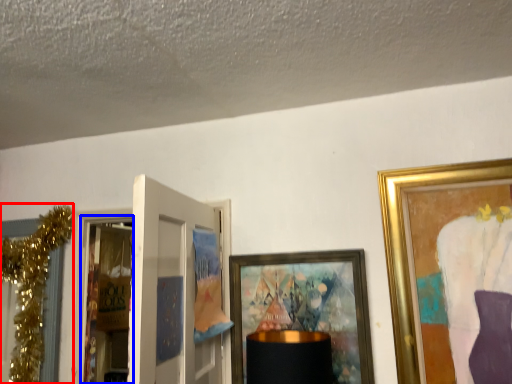
Question: Which point is further to the camera, christmas decoration (highlighted by a red box) or screen door (highlighted by a blue box)?

Choices:
 (A) christmas decoration
 (B) screen door

Answer: (B)